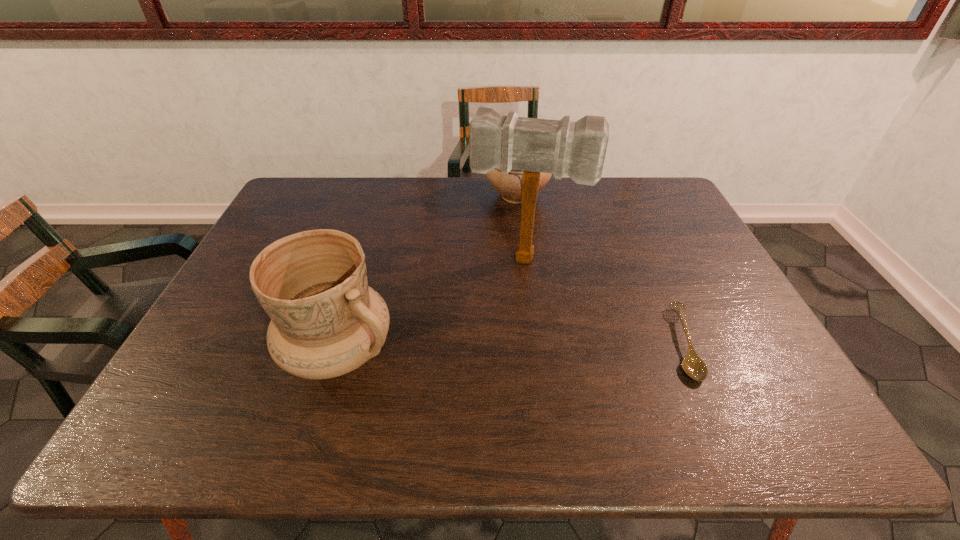
Identify the location of the leftmost object. (326, 321).

In order to click on the shortest object in this screenshot , I will do `click(694, 367)`.

The height and width of the screenshot is (540, 960). Find the location of `ladle`. ladle is located at coordinates (694, 367).

The width and height of the screenshot is (960, 540). I want to click on urn, so pos(509,186).

Identify the location of the second farthest object. The height and width of the screenshot is (540, 960). (561, 147).

What are the coordinates of `mallet` in the screenshot? It's located at (561, 147).

The height and width of the screenshot is (540, 960). I want to click on vacant space situated 0.160m on the right of the leftmost object, so click(469, 352).

Find the location of a particular element. The height and width of the screenshot is (540, 960). vacant space located 0.260m on the left of the shortest object is located at coordinates (560, 343).

Identify the location of vacant space located 0.350m on the front-facing side of the farthest object. pos(528,286).

Where is `vacant space located 0.390m on the front-facing side of the farthest object`? The height and width of the screenshot is (540, 960). vacant space located 0.390m on the front-facing side of the farthest object is located at coordinates (530, 296).